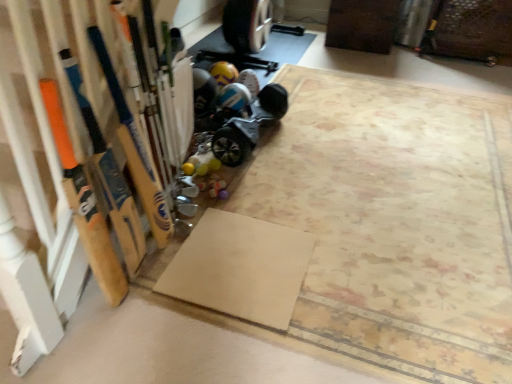
At what (x,y) coordinates should I click in order to perform the action: click on vacant region in front of wooden baseball bat at left, placed as the 2th baseball bat when sorted from left to right. Please return your answer as a coordinate pair (x, y). Looking at the image, I should click on (145, 276).